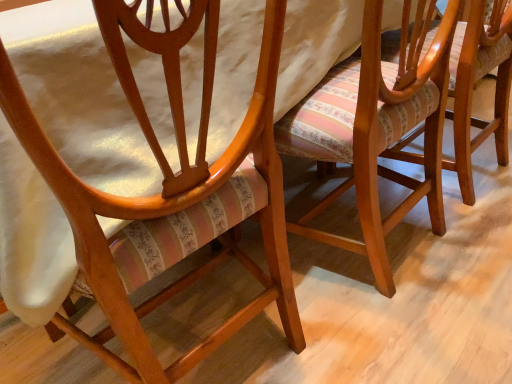
Question: Is wooden chair with striped upholstery at center, which ranks as the 2th chair in left-to-right order, not inside striped fabric cushion at center, which ranks as the 1th chair in right-to-left order?

Choices:
 (A) no
 (B) yes

Answer: (B)

Question: Considering the relative sizes of wooden chair with striped upholstery at center, which ranks as the 2th chair in left-to-right order, and striped fabric cushion at center, which ranks as the 1th chair in right-to-left order, in the image provided, is wooden chair with striped upholstery at center, which ranks as the 2th chair in left-to-right order, thinner than striped fabric cushion at center, which ranks as the 1th chair in right-to-left order,?

Choices:
 (A) yes
 (B) no

Answer: (B)

Question: Is wooden chair with striped upholstery at center, which ranks as the 2th chair in left-to-right order, positioned in front of striped fabric cushion at center, which ranks as the 1th chair in right-to-left order?

Choices:
 (A) no
 (B) yes

Answer: (B)

Question: Does wooden chair with striped upholstery at center, which is counted as the second chair, starting from the right, have a greater width compared to striped fabric cushion at center, acting as the 3th chair starting from the left?

Choices:
 (A) no
 (B) yes

Answer: (B)

Question: Is wooden chair with striped upholstery at center, which ranks as the 2th chair in left-to-right order, taller than striped fabric cushion at center, acting as the 3th chair starting from the left?

Choices:
 (A) no
 (B) yes

Answer: (B)

Question: Choose the correct answer: Is striped fabric cushion at center, which ranks as the 1th chair in right-to-left order, inside wooden chair with striped upholstery at center, which ranks as the 2th chair in left-to-right order, or outside it?

Choices:
 (A) outside
 (B) inside

Answer: (A)

Question: From a real-world perspective, relative to wooden chair with striped upholstery at center, which ranks as the 2th chair in left-to-right order, is striped fabric cushion at center, which ranks as the 1th chair in right-to-left order, vertically above or below?

Choices:
 (A) below
 (B) above

Answer: (A)

Question: Is striped fabric cushion at center, which ranks as the 1th chair in right-to-left order, in front of or behind wooden chair with striped upholstery at center, which is counted as the second chair, starting from the right, in the image?

Choices:
 (A) behind
 (B) front

Answer: (A)

Question: Based on their sizes in the image, would you say striped fabric cushion at center, acting as the 3th chair starting from the left, is bigger or smaller than wooden chair with striped upholstery at center, which is counted as the second chair, starting from the right?

Choices:
 (A) big
 (B) small

Answer: (B)

Question: In terms of size, does matte wood chair at center, marked as the 1th chair in a left-to-right arrangement, appear bigger or smaller than striped fabric cushion at center, which ranks as the 1th chair in right-to-left order?

Choices:
 (A) small
 (B) big

Answer: (B)

Question: Considering their positions, is matte wood chair at center, marked as the 1th chair in a left-to-right arrangement, located in front of or behind striped fabric cushion at center, acting as the 3th chair starting from the left?

Choices:
 (A) front
 (B) behind

Answer: (A)

Question: From the image's perspective, is matte wood chair at center, marked as the 1th chair in a left-to-right arrangement, above or below striped fabric cushion at center, which ranks as the 1th chair in right-to-left order?

Choices:
 (A) above
 (B) below

Answer: (B)

Question: Would you say matte wood chair at center, marked as the 1th chair in a left-to-right arrangement, is inside or outside striped fabric cushion at center, acting as the 3th chair starting from the left?

Choices:
 (A) outside
 (B) inside

Answer: (A)

Question: Considering the relative positions of striped fabric cushion at center, acting as the 3th chair starting from the left, and matte wood chair at center, marked as the 1th chair in a left-to-right arrangement, in the image provided, is striped fabric cushion at center, acting as the 3th chair starting from the left, to the left or to the right of matte wood chair at center, marked as the 1th chair in a left-to-right arrangement,?

Choices:
 (A) right
 (B) left

Answer: (A)

Question: From a real-world perspective, is striped fabric cushion at center, acting as the 3th chair starting from the left, positioned above or below matte wood chair at center, marked as the 1th chair in a left-to-right arrangement?

Choices:
 (A) above
 (B) below

Answer: (B)